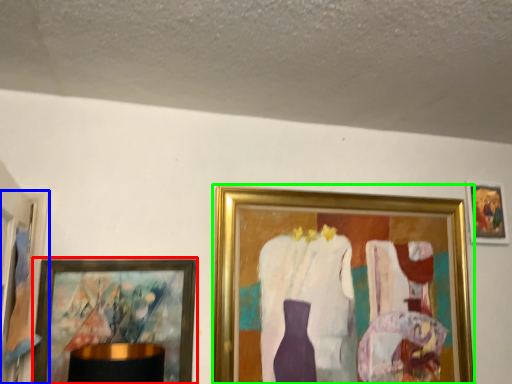
Question: Which is nearer to the picture frame (highlighted by a red box)? picture frame (highlighted by a blue box) or picture frame (highlighted by a green box).

Choices:
 (A) picture frame
 (B) picture frame

Answer: (A)